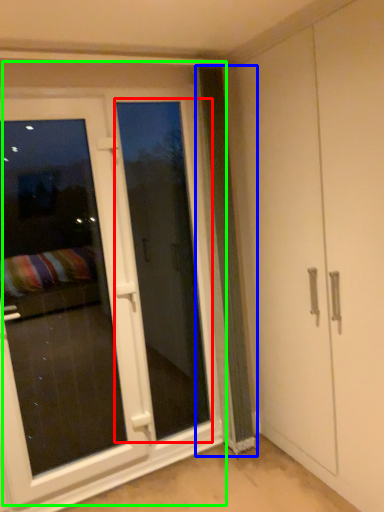
Question: Which object is positioned closest to screen door (highlighted by a red box)? Select from curtain (highlighted by a blue box) and door (highlighted by a green box).

Choices:
 (A) curtain
 (B) door

Answer: (B)